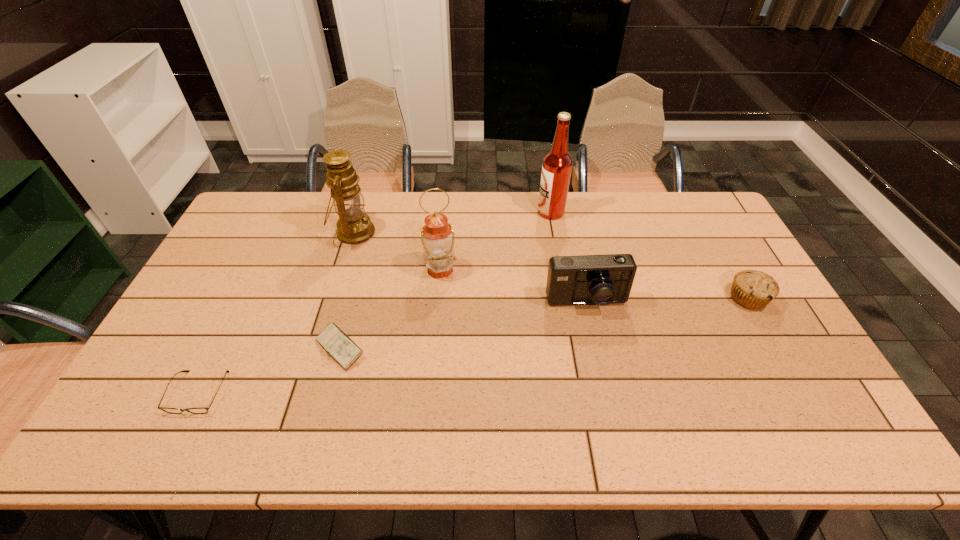
This screenshot has width=960, height=540. What are the coordinates of `object that stands as the closest to the alcohol` in the screenshot? It's located at (587, 279).

Locate an element on the screen. The width and height of the screenshot is (960, 540). vacant region that satisfies the following two spatial constraints: 1. on the back side of the third shortest object; 2. on the left side of the diary is located at coordinates (353, 298).

This screenshot has width=960, height=540. What are the coordinates of `blank space that satisfies the following two spatial constraints: 1. on the label side of the alcohol; 2. on the front side of the second shortest object` in the screenshot? It's located at (575, 348).

Where is `free point that satisfies the following two spatial constraints: 1. on the label side of the alcohol; 2. on the left side of the fifth tallest object`? free point that satisfies the following two spatial constraints: 1. on the label side of the alcohol; 2. on the left side of the fifth tallest object is located at coordinates (566, 298).

This screenshot has width=960, height=540. In order to click on vacant space that satisfies the following two spatial constraints: 1. on the front side of the left oil lamp; 2. on the left side of the muffin in this screenshot , I will do `click(334, 298)`.